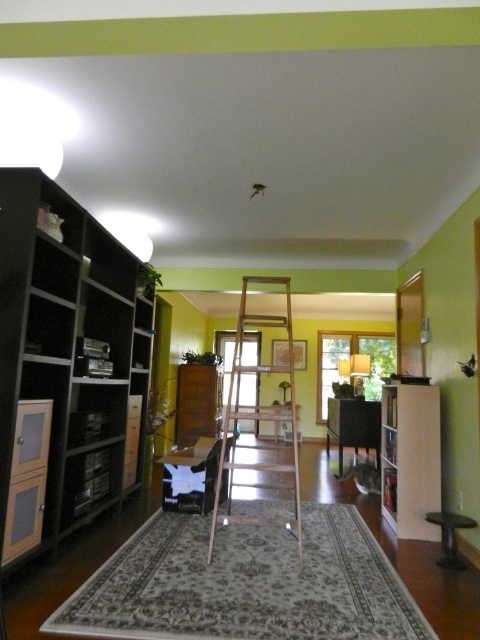
Is point (409, 468) positioned behind point (377, 428)?

That is False.

Does point (402, 467) come closer to viewer compared to point (372, 412)?

Yes, point (402, 467) is closer to viewer.

Find the location of a particular element. The height and width of the screenshot is (640, 480). white matte bookshelf at right is located at coordinates (409, 458).

What are the coordinates of `white matte bookshelf at right` in the screenshot? It's located at (409, 458).

The width and height of the screenshot is (480, 640). Find the location of `black matte bookshelf at left`. black matte bookshelf at left is located at coordinates (64, 364).

This screenshot has width=480, height=640. Describe the element at coordinates (64, 364) in the screenshot. I see `black matte bookshelf at left` at that location.

Does point (109, 291) come in front of point (370, 435)?

Yes, it is.

At what (x,y) coordinates should I click in order to perform the action: click on black matte bookshelf at left. Please return your answer as a coordinate pair (x, y). The image size is (480, 640). Looking at the image, I should click on (64, 364).

Does black matte bookshelf at left appear on the right side of black plastic stool at lower right?

In fact, black matte bookshelf at left is to the left of black plastic stool at lower right.

Between black matte bookshelf at left and black plastic stool at lower right, which one has more height?

Standing taller between the two is black matte bookshelf at left.

The height and width of the screenshot is (640, 480). What do you see at coordinates (64, 364) in the screenshot?
I see `black matte bookshelf at left` at bounding box center [64, 364].

At what (x,y) coordinates should I click in order to perform the action: click on black matte bookshelf at left. Please return your answer as a coordinate pair (x, y). The height and width of the screenshot is (640, 480). Looking at the image, I should click on (64, 364).